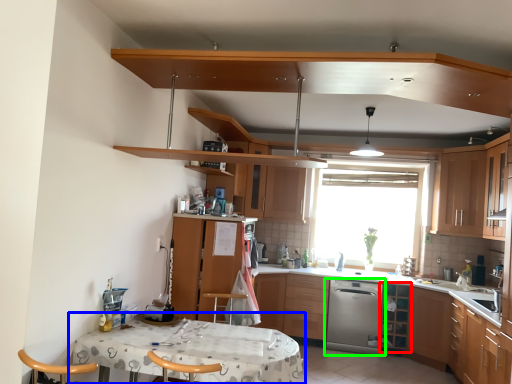
Question: Which object is positioned farthest from shelf (highlighted by a red box)? Select from table (highlighted by a blue box) and kitchen appliance (highlighted by a green box).

Choices:
 (A) table
 (B) kitchen appliance

Answer: (A)